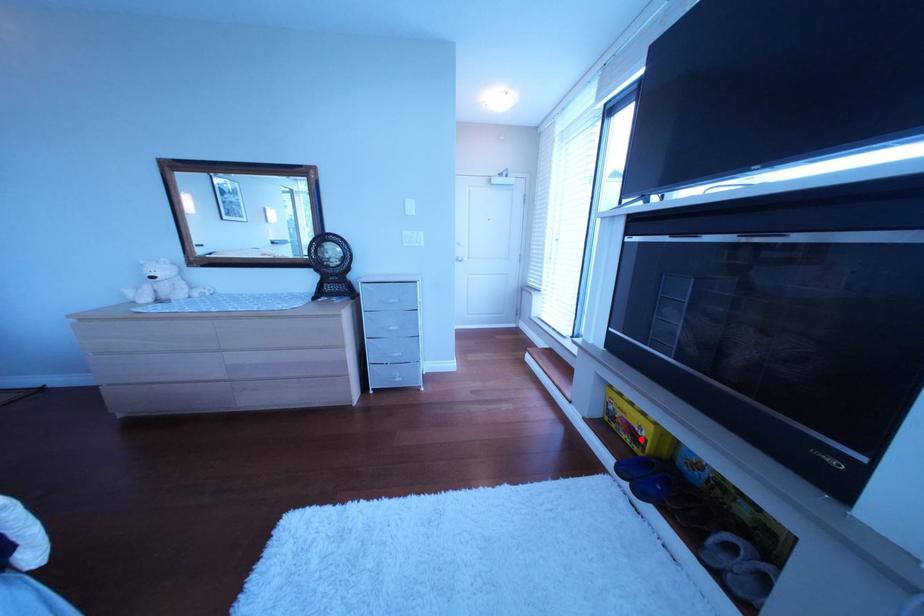
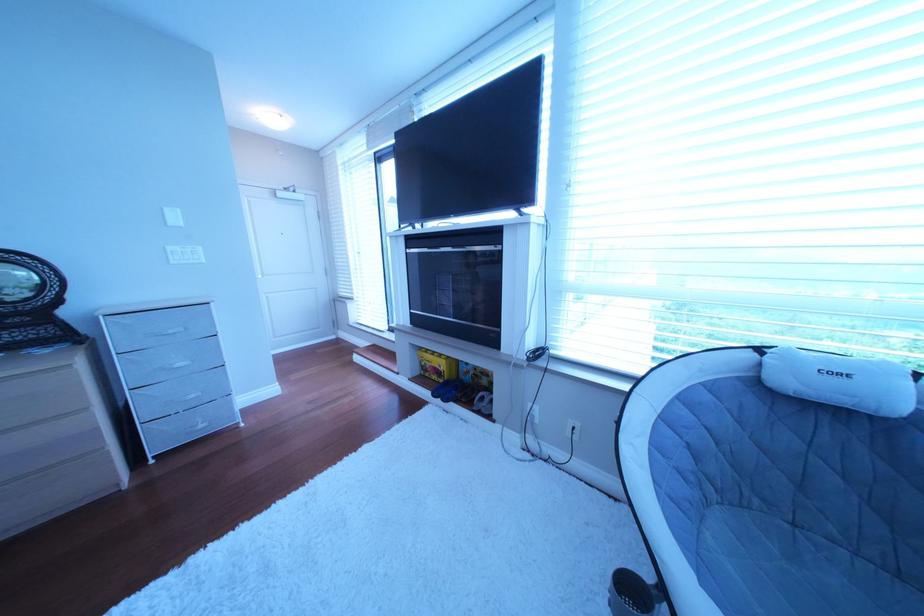
Locate, in the second image, the point that corresponds to the highlighted location in the first image.

(450, 379)